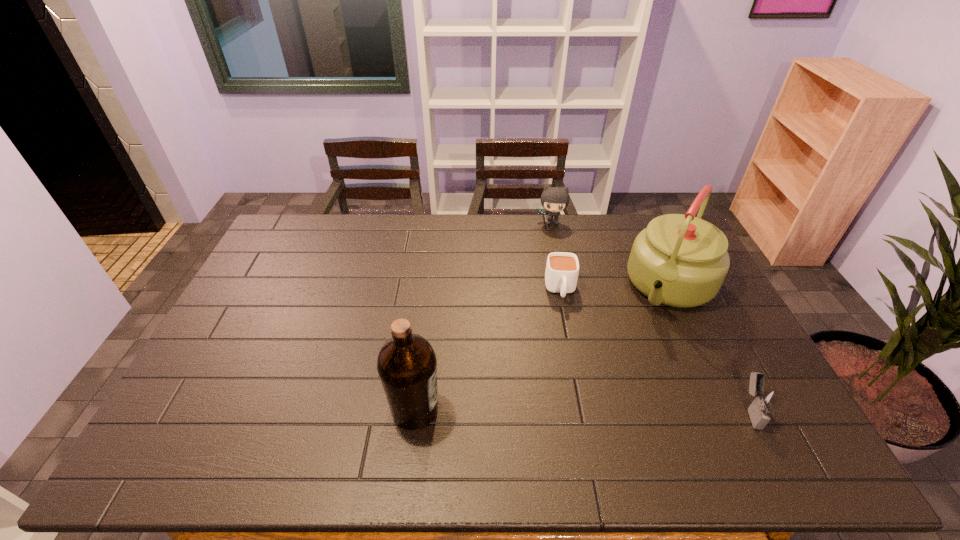
Where is `free spot between the olive oil and the cup`? free spot between the olive oil and the cup is located at coordinates (488, 349).

Identify the location of free spot between the shortest object and the second shortest object. (655, 349).

What are the coordinates of `empty space between the kettle and the shortest object` in the screenshot? It's located at (616, 288).

The image size is (960, 540). In order to click on free space between the olive oil and the kettle in this screenshot , I will do `click(543, 348)`.

You are a GUI agent. You are given a task and a screenshot of the screen. Output one action in this format:
    pyautogui.click(x=<x>, y=<y>)
    Task: Click on the vacant area that lies between the kettle and the leftmost object
    
    Given the screenshot: What is the action you would take?
    pyautogui.click(x=543, y=348)

I want to click on empty location between the kitten and the leftmost object, so click(483, 315).

Locate which object ranks fourth in proximity to the kettle. Please provide its 2D coordinates. Your answer should be formatted as a tuple, i.e. [(x, y)], where the tuple contains the x and y coordinates of a point satisfying the conditions above.

[(407, 365)]

Choose which object is the nearest neighbor to the third shortest object. Please provide its 2D coordinates. Your answer should be formatted as a tuple, i.e. [(x, y)], where the tuple contains the x and y coordinates of a point satisfying the conditions above.

[(679, 260)]

Where is `free location that satisfies the following two spatial constraints: 1. on the back side of the third shortest object; 2. on the left side of the cup`? free location that satisfies the following two spatial constraints: 1. on the back side of the third shortest object; 2. on the left side of the cup is located at coordinates (x=547, y=222).